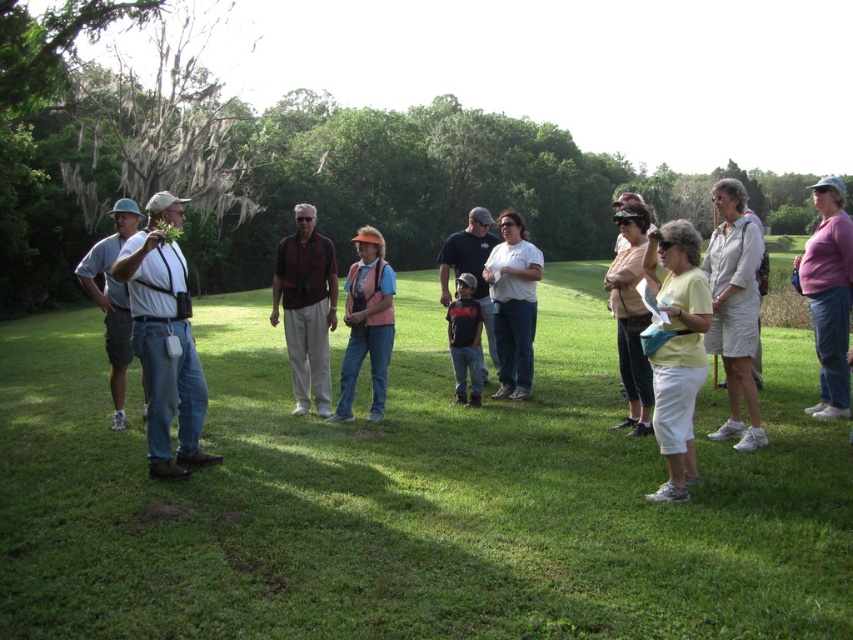
Question: Is denim jeans at left smaller than white cotton shirt at center?

Choices:
 (A) no
 (B) yes

Answer: (B)

Question: Can you confirm if white cotton shorts at right is thinner than dark blue shirt at center?

Choices:
 (A) no
 (B) yes

Answer: (A)

Question: Based on their relative distances, which object is nearer to the dark blue shirt at center?

Choices:
 (A) white cotton shorts at right
 (B) denim jeans at left
 (C) green grass at center
 (D) yellow fabric purse at center

Answer: (A)

Question: Which point is closer to the camera?

Choices:
 (A) green grass at center
 (B) pink fabric vest at center

Answer: (A)

Question: Which object appears farthest from the camera in this image?

Choices:
 (A) dark blue shirt at center
 (B) pink fabric vest at center
 (C) pink fabric shirt at center

Answer: (A)

Question: Does white cotton shorts at right have a greater width compared to pink fabric shirt at center?

Choices:
 (A) no
 (B) yes

Answer: (A)